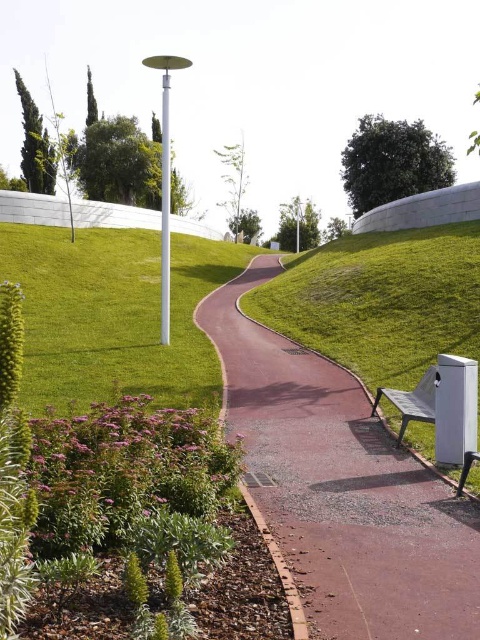
You are a gardener planning to install a new sprinkler system along the path. The sprinkler needs to be placed exactly at the center of the pink rubber path at center. According to the coordinates provided, where should the sprinkler be positioned?

The pink rubber path at center should have the sprinkler placed at the coordinates point (340, 486) as specified.

You are standing at the point marked by the coordinates point (x=113, y=314) in the image. Based on the scene description, what is the immediate surface you are standing on?

The immediate surface at point (x=113, y=314) is green grass at lower left, as indicated by the coordinates provided.